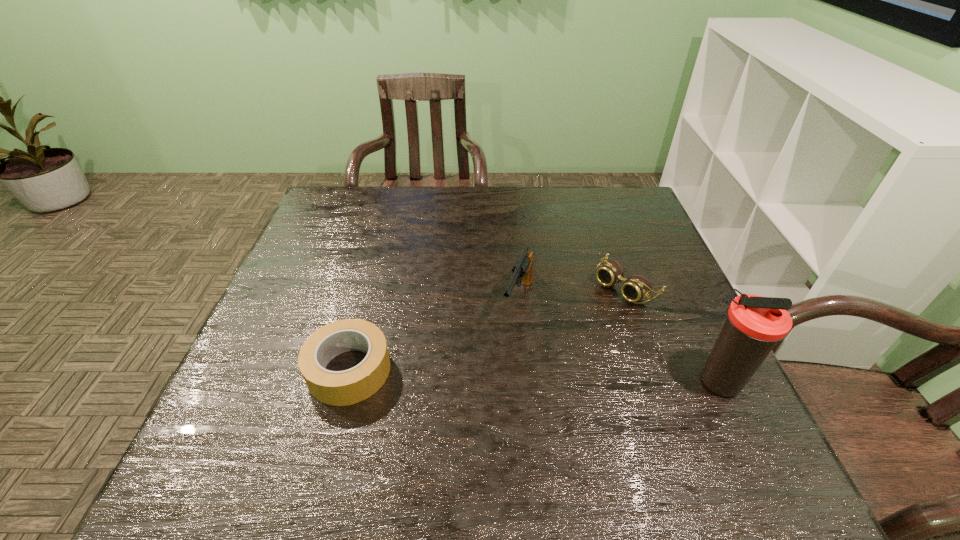
Locate an element on the screen. The width and height of the screenshot is (960, 540). vacant space that satisfies the following two spatial constraints: 1. on the front side of the goggles; 2. on the right side of the tallest object is located at coordinates (659, 381).

Find the location of a particular element. Image resolution: width=960 pixels, height=540 pixels. free location that satisfies the following two spatial constraints: 1. on the front side of the second tallest object; 2. on the left side of the tallest object is located at coordinates (526, 381).

Image resolution: width=960 pixels, height=540 pixels. In order to click on free region that satisfies the following two spatial constraints: 1. on the front side of the goggles; 2. on the right side of the tallest object in this screenshot , I will do tap(659, 381).

Identify the location of free space in the image that satisfies the following two spatial constraints: 1. on the back side of the goggles; 2. on the right side of the gun. (517, 286).